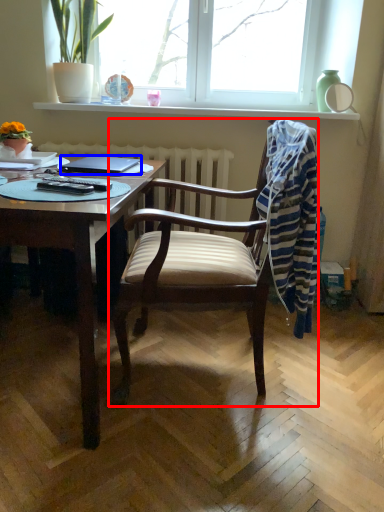
Question: Which object appears farthest to the camera in this image, chair (highlighted by a red box) or laptop (highlighted by a blue box)?

Choices:
 (A) chair
 (B) laptop

Answer: (B)